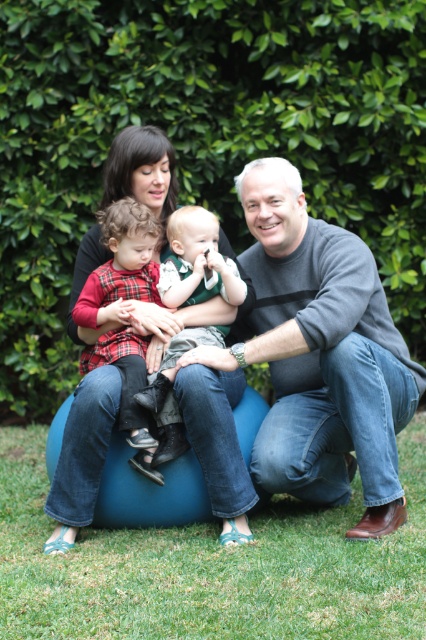
Question: Is gray sweater at center below matte black sweater at center?

Choices:
 (A) no
 (B) yes

Answer: (A)

Question: Which of the following is the closest to the observer?

Choices:
 (A) matte black sweater at center
 (B) green grass at lower center

Answer: (B)

Question: Which object is closer to the camera taking this photo?

Choices:
 (A) plaid fabric shirt at left
 (B) green textured shirt at center

Answer: (B)

Question: Which object is positioned farthest from the green grass at lower center?

Choices:
 (A) matte black sweater at center
 (B) green textured shirt at center
 (C) gray sweater at center
 (D) plaid fabric shirt at left

Answer: (B)

Question: Does matte black sweater at center have a greater width compared to blue fabric bean bag at center?

Choices:
 (A) no
 (B) yes

Answer: (B)

Question: Considering the relative positions of gray sweater at center and blue fabric bean bag at center in the image provided, where is gray sweater at center located with respect to blue fabric bean bag at center?

Choices:
 (A) right
 (B) left

Answer: (A)